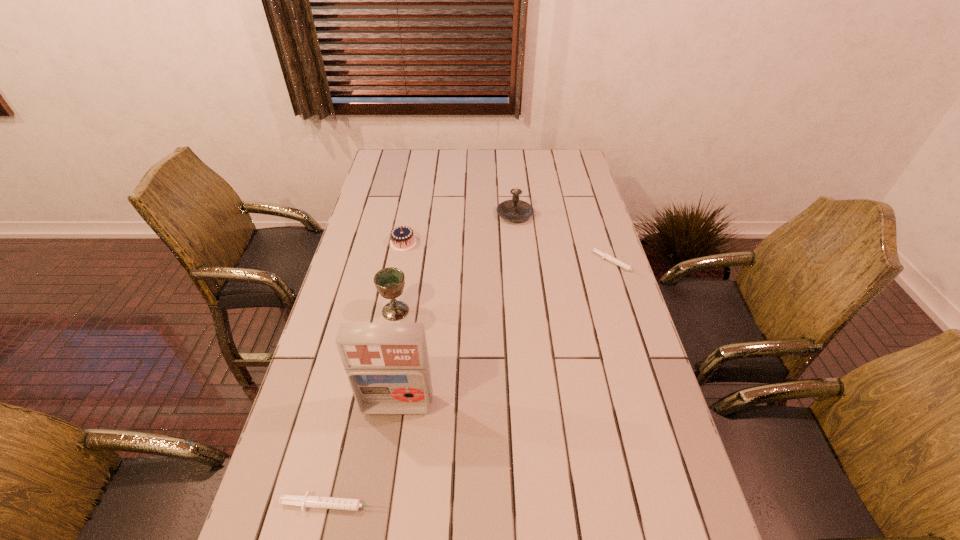
Identify the location of vacant area that lies between the right syringe and the first-aid kit. The height and width of the screenshot is (540, 960). (507, 335).

The height and width of the screenshot is (540, 960). I want to click on blank region between the chalice and the fifth object from left to right, so click(x=455, y=262).

The image size is (960, 540). Find the location of `free space between the farthest object and the right syringe`. free space between the farthest object and the right syringe is located at coordinates (565, 239).

Where is `vacant area between the first-aid kit and the second shortest object`? The width and height of the screenshot is (960, 540). vacant area between the first-aid kit and the second shortest object is located at coordinates (367, 454).

Find the location of a particular element. The width and height of the screenshot is (960, 540). the closest object to the shortest object is located at coordinates (513, 210).

The image size is (960, 540). In order to click on object that stands as the third closest to the farthest object in this screenshot , I will do `click(389, 282)`.

Identify the location of vacant position in the image that satisfies the following two spatial constraints: 1. on the back side of the farthest object; 2. on the right side of the fourth farthest object. (413, 214).